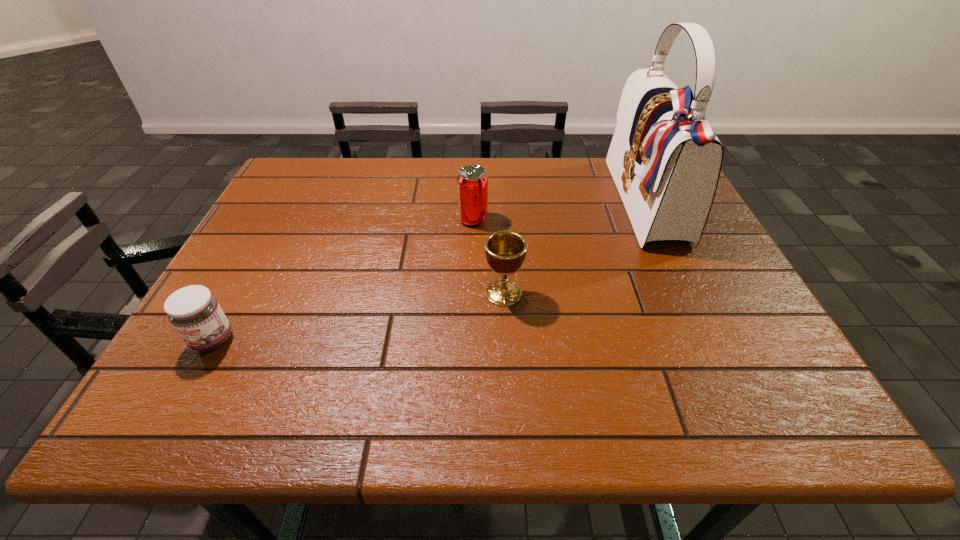
At what (x,y) coordinates should I click in order to perform the action: click on free space located on the right of the chalice. Please return your answer as a coordinate pair (x, y). The height and width of the screenshot is (540, 960). Looking at the image, I should click on (702, 293).

Where is `free location located 0.080m on the front label of the shortest object`? Image resolution: width=960 pixels, height=540 pixels. free location located 0.080m on the front label of the shortest object is located at coordinates (183, 394).

The image size is (960, 540). Identify the location of object that is positioned at the far edge. pos(665,160).

Identify the location of object that is at the left edge. (195, 313).

In order to click on object that is at the right edge in this screenshot , I will do `click(665, 160)`.

Where is `object located in the far right corner section of the desktop`? This screenshot has width=960, height=540. object located in the far right corner section of the desktop is located at coordinates (665, 160).

Where is `vacant space at the far edge of the desktop`? vacant space at the far edge of the desktop is located at coordinates (535, 176).

At what (x,y) coordinates should I click in order to perform the action: click on blank space at the near edge of the desktop. Please return your answer as a coordinate pair (x, y). The width and height of the screenshot is (960, 540). Looking at the image, I should click on (298, 421).

In the image, there is a desktop. Where is `blank space at the left edge`? The width and height of the screenshot is (960, 540). blank space at the left edge is located at coordinates (229, 355).

Find the location of a particular element. This screenshot has height=540, width=960. blank space at the right edge of the desktop is located at coordinates (698, 249).